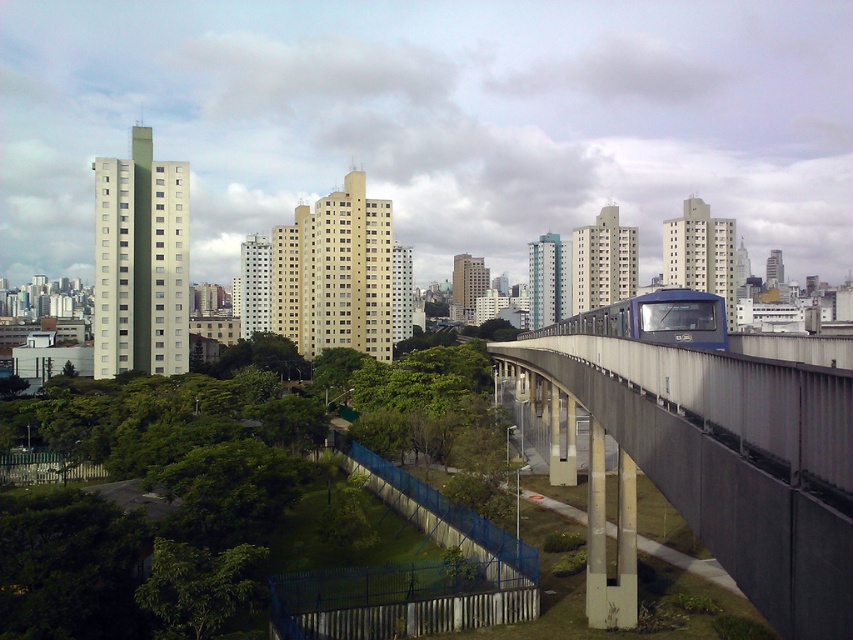
Question: Does green leafy tree at center have a greater width compared to blue metallic train at center?

Choices:
 (A) yes
 (B) no

Answer: (A)

Question: Can you confirm if concrete bridge at right is bigger than blue metallic train at center?

Choices:
 (A) no
 (B) yes

Answer: (A)

Question: Which of the following is the farthest from the observer?

Choices:
 (A) green leafy tree at center
 (B) blue metallic train at center
 (C) concrete bridge at right

Answer: (A)

Question: Which object appears closest to the camera in this image?

Choices:
 (A) blue metallic train at center
 (B) green leafy tree at center

Answer: (A)

Question: Which object appears closest to the camera in this image?

Choices:
 (A) concrete bridge at right
 (B) blue metallic train at center
 (C) green leafy tree at center

Answer: (A)

Question: Can you confirm if concrete bridge at right is wider than blue metallic train at center?

Choices:
 (A) no
 (B) yes

Answer: (A)